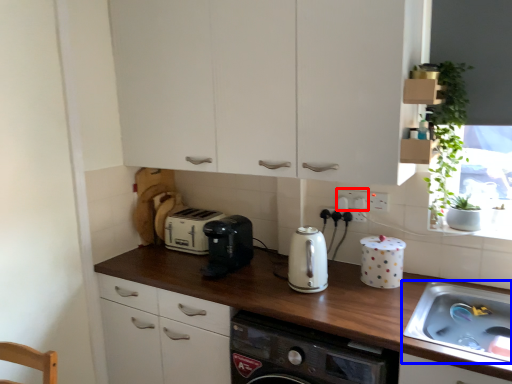
Question: Which of the following is the closest to the observer, electric outlet (highlighted by a red box) or sink (highlighted by a blue box)?

Choices:
 (A) electric outlet
 (B) sink

Answer: (B)